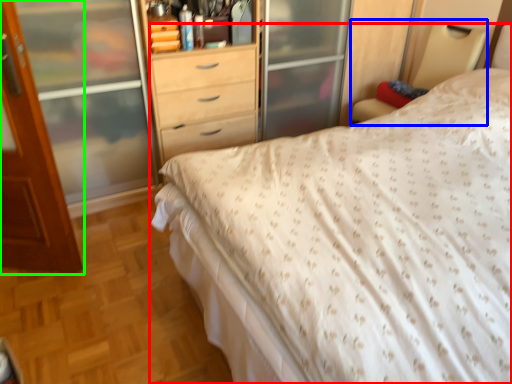
Question: Which object is the farthest from bed (highlighted by a red box)? Choose among these: bed frame (highlighted by a blue box) or door (highlighted by a green box).

Choices:
 (A) bed frame
 (B) door

Answer: (A)